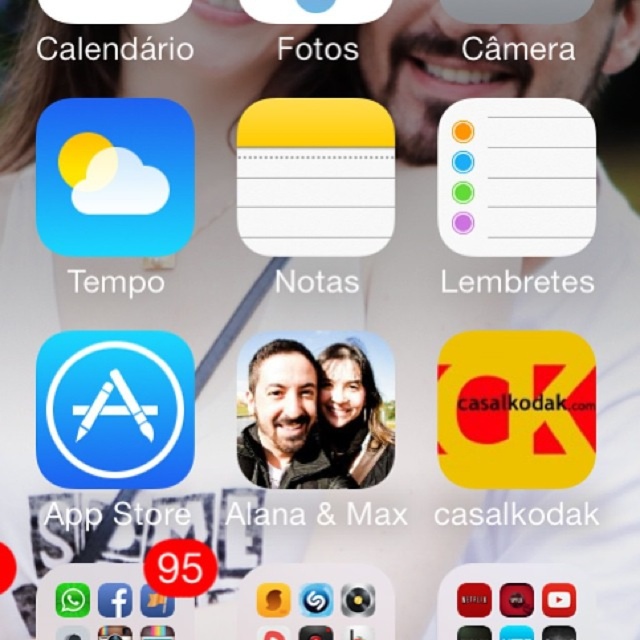
Is matte black portrait at center in front of smooth skin portrait at center?

No, matte black portrait at center is further to the viewer.

Is matte black portrait at center thinner than smooth skin portrait at center?

In fact, matte black portrait at center might be wider than smooth skin portrait at center.

The height and width of the screenshot is (640, 640). Describe the element at coordinates (284, 420) in the screenshot. I see `matte black portrait at center` at that location.

You are a GUI agent. You are given a task and a screenshot of the screen. Output one action in this format:
    pyautogui.click(x=<x>, y=<y>)
    Task: Click on the matte black portrait at center
    
    Given the screenshot: What is the action you would take?
    pyautogui.click(x=284, y=420)